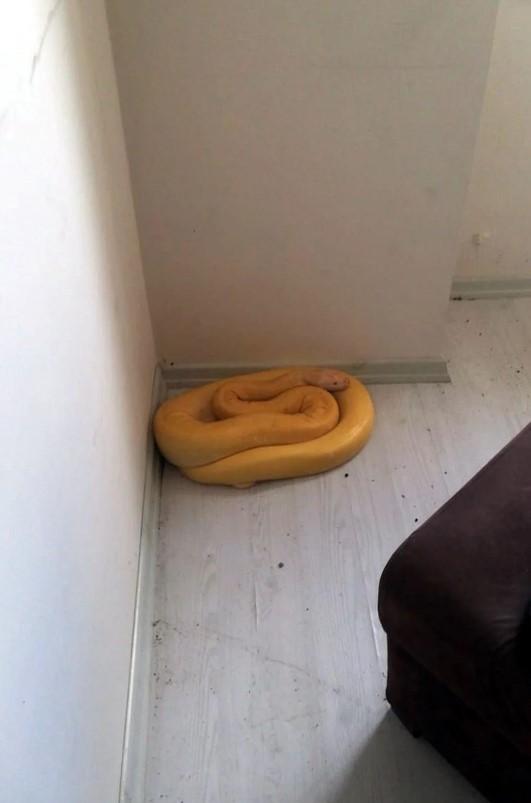
Find the location of `corner of furniture`. corner of furniture is located at coordinates (408, 569).